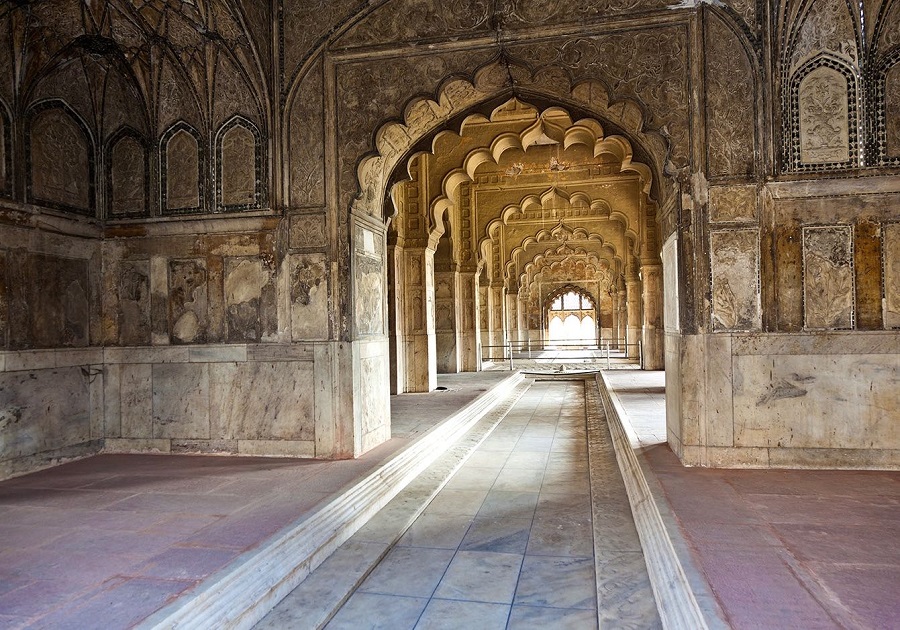
At what (x,y) coordinates should I click in order to perform the action: click on archways. Please return your answer as a coordinate pair (x, y). This screenshot has height=630, width=900. Looking at the image, I should click on (480, 88), (500, 138), (520, 186), (532, 231).